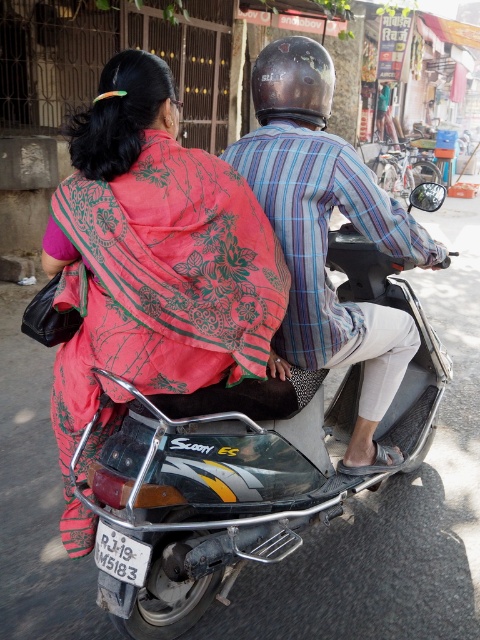
Question: Which object is positioned closest to the matte pink saree at center?

Choices:
 (A) metallic silver scooter at center
 (B) striped fabric shirt at center

Answer: (B)

Question: Does metallic silver scooter at center appear on the right side of striped fabric shirt at center?

Choices:
 (A) yes
 (B) no

Answer: (B)

Question: Which point is farther to the camera?

Choices:
 (A) (110, 307)
 (B) (289, 129)
 (C) (319, 458)

Answer: (C)

Question: Considering the relative positions of matte pink saree at center and striped fabric shirt at center in the image provided, where is matte pink saree at center located with respect to striped fabric shirt at center?

Choices:
 (A) left
 (B) right

Answer: (A)

Question: Which of the following is the closest to the observer?

Choices:
 (A) striped fabric shirt at center
 (B) matte pink saree at center

Answer: (B)

Question: Is matte pink saree at center below metallic silver scooter at center?

Choices:
 (A) no
 (B) yes

Answer: (A)